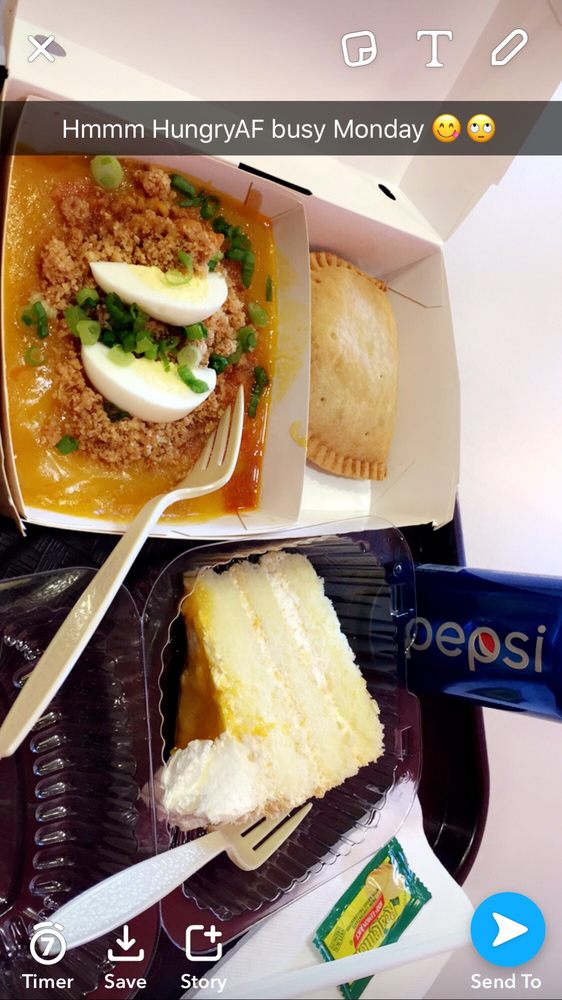
Locate an element on the screen. The height and width of the screenshot is (1000, 562). fork is located at coordinates (201, 850), (184, 488).